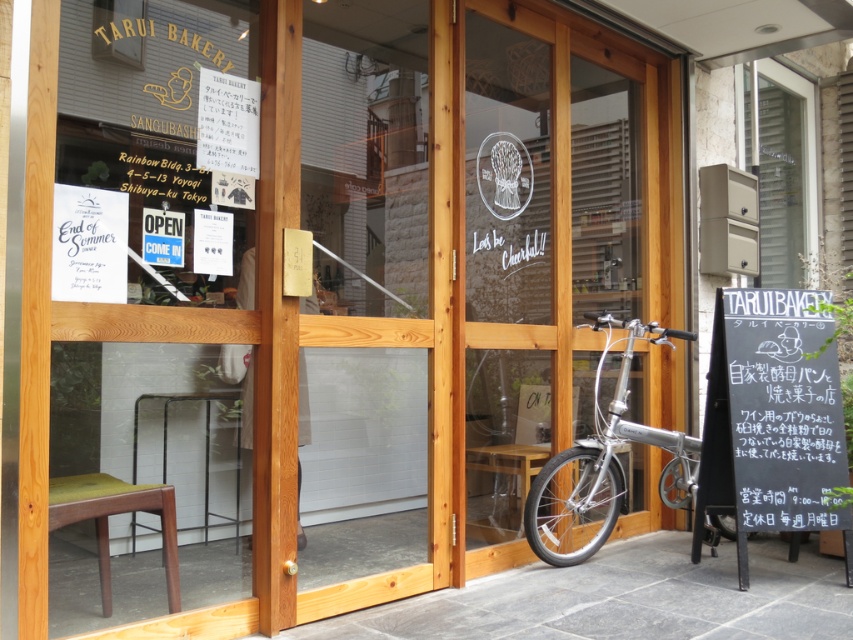
What is the relationship in size between the silver metallic bicycle at center and the clear glass mailbox at upper right?

The silver metallic bicycle at center has a smaller size compared to clear glass mailbox at upper right.

You are a customer entering the bakery and want to sit down immediately. There are two seating options available at the entrance, a wooden chair at lower left and a green velvet stool at lower left. Which one would you choose if you prefer a more spacious seating option?

The wooden chair at lower left is larger in size than the green velvet stool at lower left, so you should choose the wooden chair at lower left for a more spacious seating option.